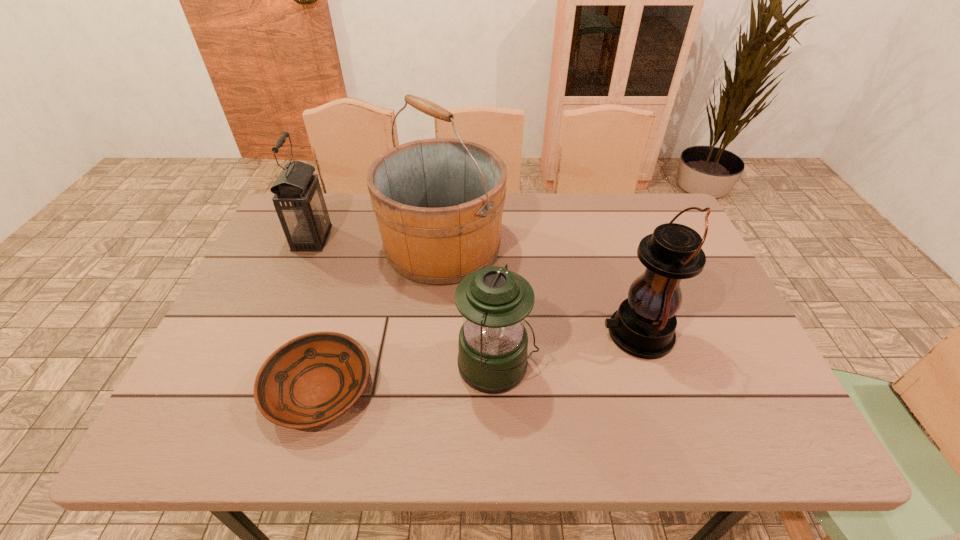
Where is `empty location between the rightmost lantern and the shortest lantern`? empty location between the rightmost lantern and the shortest lantern is located at coordinates (567, 350).

At what (x,y) coordinates should I click in order to perform the action: click on unoccupied position between the tallest object and the rightmost object. Please return your answer as a coordinate pair (x, y). This screenshot has height=540, width=960. Looking at the image, I should click on (540, 290).

Where is `free space between the farthest lantern and the plate`? This screenshot has height=540, width=960. free space between the farthest lantern and the plate is located at coordinates (316, 313).

Image resolution: width=960 pixels, height=540 pixels. What are the coordinates of `free point between the bucket and the rightmost object` in the screenshot? It's located at (540, 290).

Select which object appears as the second closest to the leftmost lantern. Please provide its 2D coordinates. Your answer should be formatted as a tuple, i.e. [(x, y)], where the tuple contains the x and y coordinates of a point satisfying the conditions above.

[(313, 379)]

The height and width of the screenshot is (540, 960). Find the location of `object that is the second closest to the farthest lantern`. object that is the second closest to the farthest lantern is located at coordinates (313, 379).

Locate an element on the screen. The width and height of the screenshot is (960, 540). the second closest lantern to the farthest lantern is located at coordinates (644, 325).

Where is `lantern that is the closest to the leftmost lantern`? The height and width of the screenshot is (540, 960). lantern that is the closest to the leftmost lantern is located at coordinates (492, 348).

Find the location of a particular element. The image size is (960, 540). free space that satisfies the following two spatial constraints: 1. on the back side of the shortest object; 2. on the front-facing side of the leftmost lantern is located at coordinates (364, 238).

The image size is (960, 540). In order to click on vacant space that satisfies the following two spatial constraints: 1. on the front-facing side of the farthest lantern; 2. on the right side of the tallest object in this screenshot , I will do `click(309, 246)`.